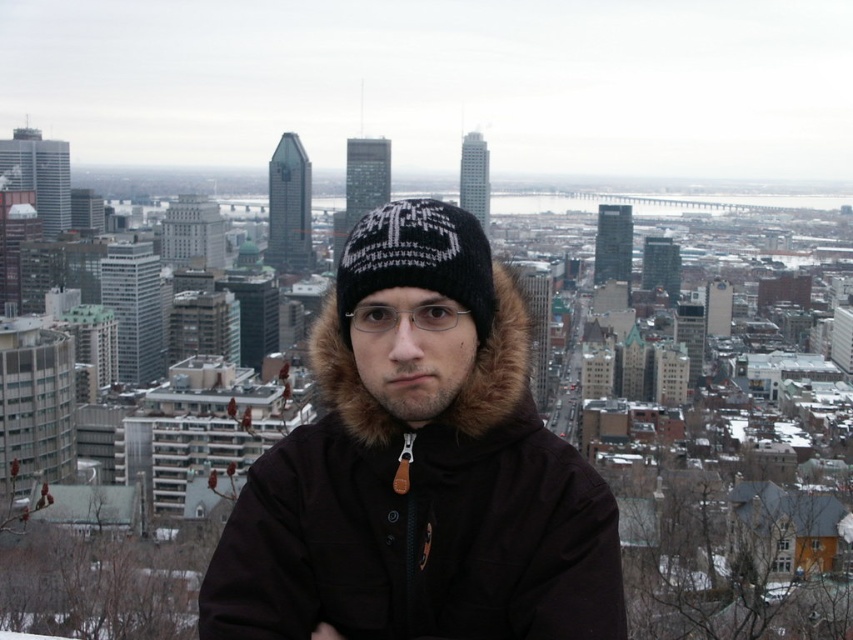
Question: Does brown fur-lined coat at center have a greater width compared to black knitted hat at center?

Choices:
 (A) yes
 (B) no

Answer: (A)

Question: Can you confirm if brown fur-lined coat at center is wider than black knitted hat at center?

Choices:
 (A) no
 (B) yes

Answer: (B)

Question: Which point is closer to the camera taking this photo?

Choices:
 (A) (434, 204)
 (B) (593, 637)

Answer: (B)

Question: Which point appears closest to the camera in this image?

Choices:
 (A) (469, 563)
 (B) (426, 230)

Answer: (A)

Question: Is brown fur-lined coat at center thinner than black knitted hat at center?

Choices:
 (A) yes
 (B) no

Answer: (B)